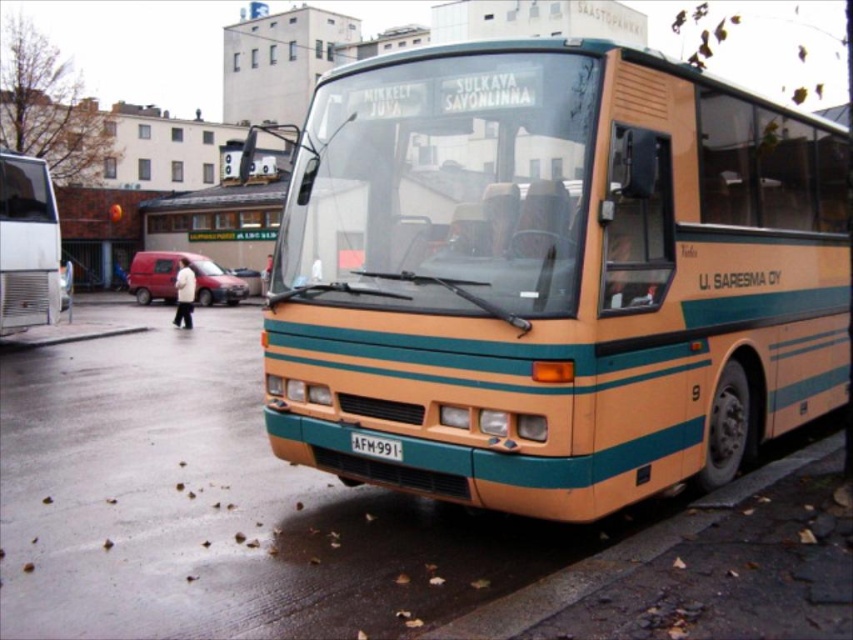
You are a delivery person who needs to load a package onto the roof of the matte orange bus at center and the metallic silver bus at left. Which bus will require you to use a taller ladder?

The matte orange bus at center is much taller than the metallic silver bus at left, so you will need a taller ladder for the matte orange bus at center.

You are a photographer trying to capture the metallic silver bus at left and the white plastic license plate at center in a single frame. Given their sizes, which object will appear bigger in your photo?

The metallic silver bus at left will appear bigger in the photo because it has a larger size compared to the white plastic license plate at center.

You are a pedestrian standing on the sidewalk. You see the matte orange bus at center and the metallic silver bus at left. Which bus is closer to the left side of the road?

The metallic silver bus at left is closer to the left side of the road because it is positioned to the left of the matte orange bus at center.